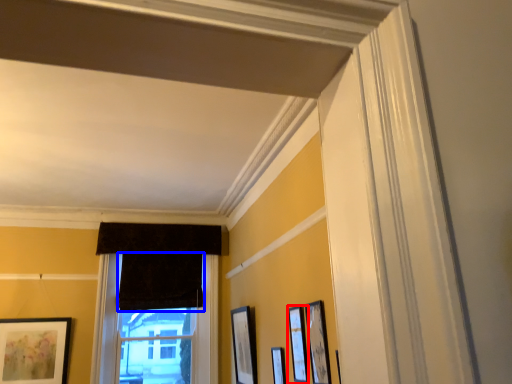
Question: Among these objects, which one is farthest to the camera, picture frame (highlighted by a red box) or curtain (highlighted by a blue box)?

Choices:
 (A) picture frame
 (B) curtain

Answer: (B)